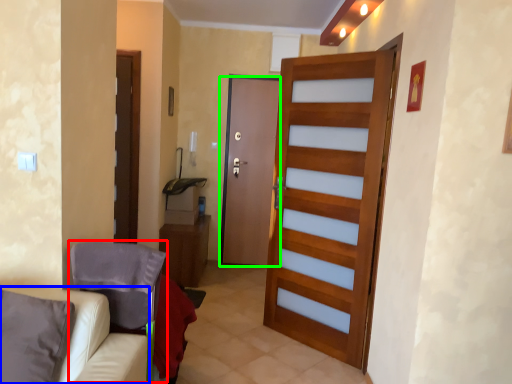
Question: Estimate the real-world distances between objects in this image. Which object is closer to armchair (highlighted by a red box), furniture (highlighted by a blue box) or door (highlighted by a green box)?

Choices:
 (A) furniture
 (B) door

Answer: (A)